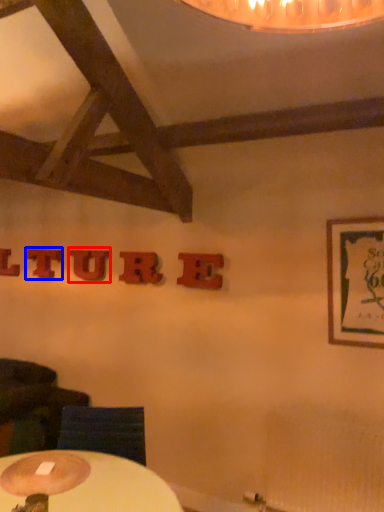
Question: Which object appears closest to the camera in this image, letter (highlighted by a red box) or letter (highlighted by a blue box)?

Choices:
 (A) letter
 (B) letter

Answer: (A)